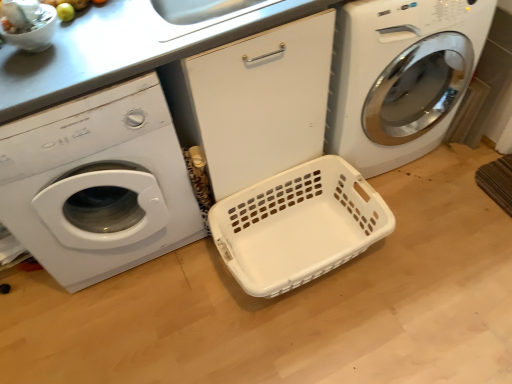
Question: Should I look upward or downward to see white plastic washing machine at left, which is the 1th washing machine from left to right?

Choices:
 (A) up
 (B) down

Answer: (A)

Question: Does white plastic basket at center come in front of white glossy washing machine at center, the 2th washing machine viewed from the left?

Choices:
 (A) no
 (B) yes

Answer: (A)

Question: Considering the relative sizes of white plastic basket at center and white glossy washing machine at center, the 2th washing machine viewed from the left, in the image provided, is white plastic basket at center thinner than white glossy washing machine at center, the 2th washing machine viewed from the left,?

Choices:
 (A) yes
 (B) no

Answer: (A)

Question: Is white plastic basket at center turned away from white glossy washing machine at center, marked as the 1th washing machine in a right-to-left arrangement?

Choices:
 (A) no
 (B) yes

Answer: (A)

Question: Does white plastic basket at center lie behind white glossy washing machine at center, marked as the 1th washing machine in a right-to-left arrangement?

Choices:
 (A) no
 (B) yes

Answer: (B)

Question: From a real-world perspective, is white plastic basket at center located beneath white glossy washing machine at center, the 2th washing machine viewed from the left?

Choices:
 (A) no
 (B) yes

Answer: (B)

Question: Is white plastic basket at center smaller than white glossy washing machine at center, marked as the 1th washing machine in a right-to-left arrangement?

Choices:
 (A) no
 (B) yes

Answer: (B)

Question: Is white glossy washing machine at center, marked as the 1th washing machine in a right-to-left arrangement, to the right of white plastic washing machine at left, the second washing machine from the right, from the viewer's perspective?

Choices:
 (A) yes
 (B) no

Answer: (A)

Question: Is white plastic washing machine at left, the second washing machine from the right, at the back of white glossy washing machine at center, the 2th washing machine viewed from the left?

Choices:
 (A) no
 (B) yes

Answer: (A)

Question: From a real-world perspective, is white glossy washing machine at center, the 2th washing machine viewed from the left, located higher than white plastic washing machine at left, the second washing machine from the right?

Choices:
 (A) no
 (B) yes

Answer: (A)

Question: Considering the relative positions of white glossy washing machine at center, the 2th washing machine viewed from the left, and white plastic washing machine at left, the second washing machine from the right, in the image provided, is white glossy washing machine at center, the 2th washing machine viewed from the left, in front of white plastic washing machine at left, the second washing machine from the right,?

Choices:
 (A) no
 (B) yes

Answer: (A)

Question: Is white glossy washing machine at center, marked as the 1th washing machine in a right-to-left arrangement, positioned beyond the bounds of white plastic washing machine at left, which is the 1th washing machine from left to right?

Choices:
 (A) no
 (B) yes

Answer: (B)

Question: Does white glossy washing machine at center, the 2th washing machine viewed from the left, have a greater width compared to white plastic washing machine at left, which is the 1th washing machine from left to right?

Choices:
 (A) no
 (B) yes

Answer: (B)

Question: Is white plastic basket at center wider than white plastic washing machine at left, the second washing machine from the right?

Choices:
 (A) no
 (B) yes

Answer: (A)